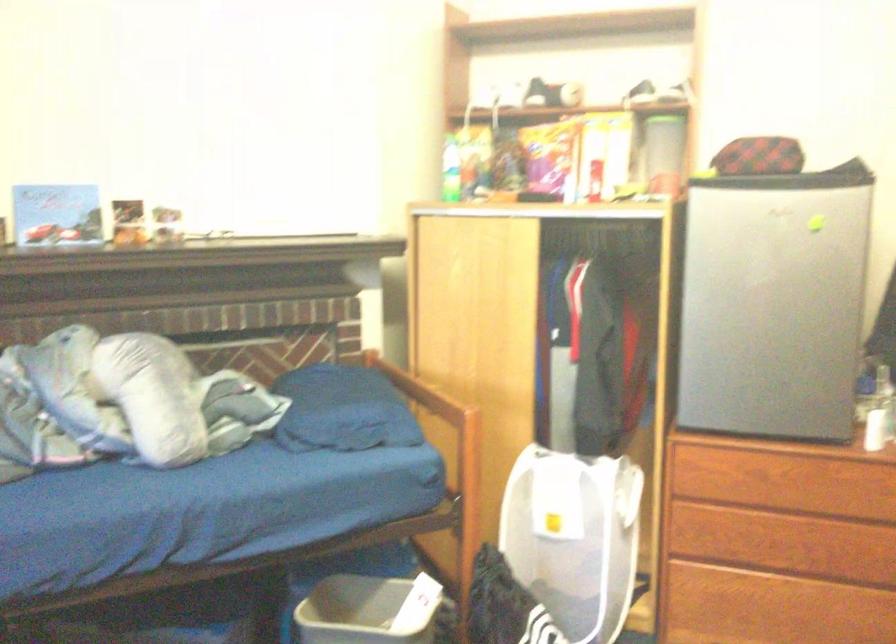
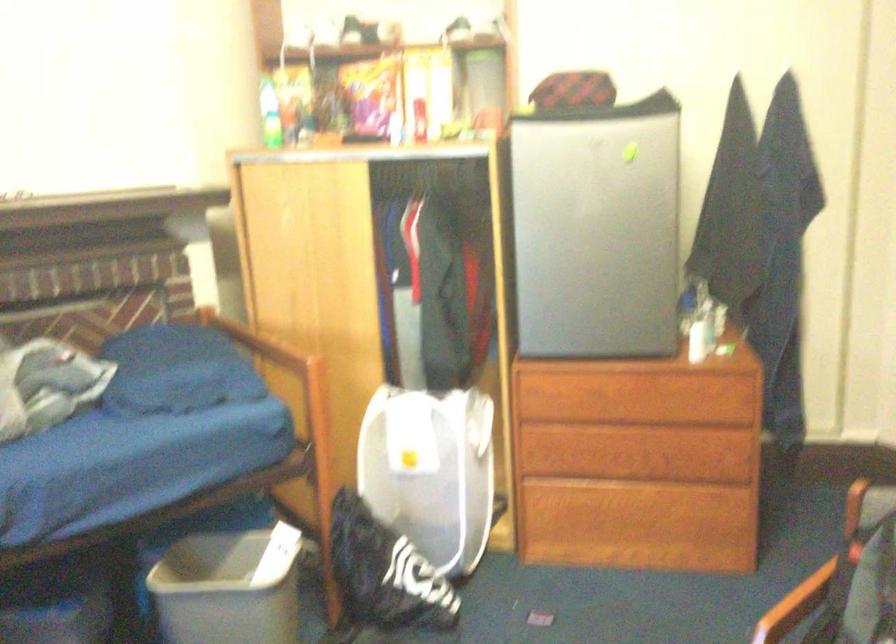
Which direction would the cameraman need to move to produce the second image?

The cameraman walked toward right, forward.